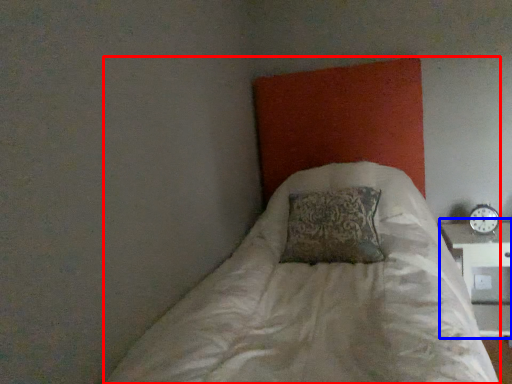
Question: Which object is further to the camera taking this photo, bed (highlighted by a red box) or table (highlighted by a blue box)?

Choices:
 (A) bed
 (B) table

Answer: (B)